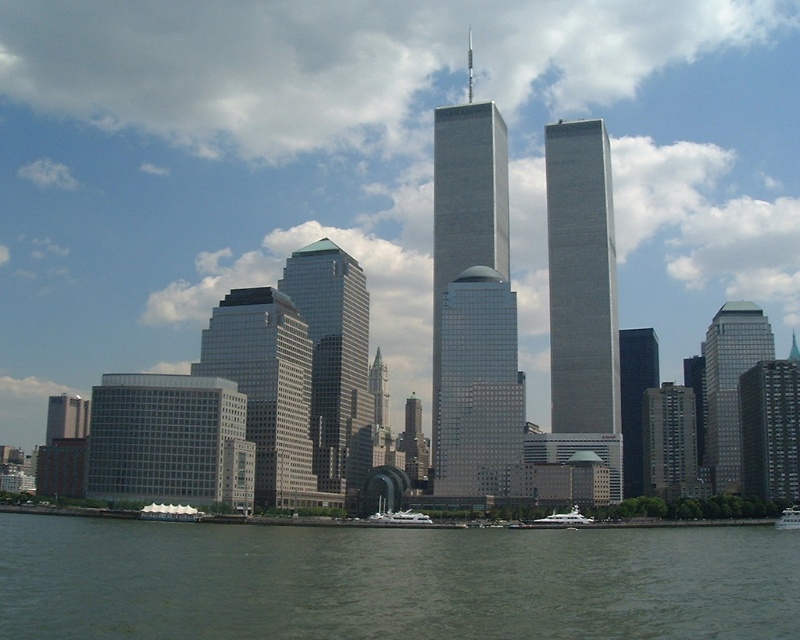
Is matte glass skyscraper at center-left behind gray glass building at center?

No.

From the picture: Who is positioned more to the left, matte glass skyscraper at center-left or gray glass building at center?

matte glass skyscraper at center-left is more to the left.

You are a GUI agent. You are given a task and a screenshot of the screen. Output one action in this format:
    pyautogui.click(x=<x>, y=<y>)
    Task: Click on the matte glass skyscraper at center-left
    The width and height of the screenshot is (800, 640).
    Given the screenshot: What is the action you would take?
    pyautogui.click(x=266, y=387)

How distant is gray glass building at center from green glass skyscraper at center?

gray glass building at center and green glass skyscraper at center are 46.06 meters apart from each other.

Is gray glass building at center smaller than green glass skyscraper at center?

Correct, gray glass building at center occupies less space than green glass skyscraper at center.

Find the location of a particular element. Image resolution: width=800 pixels, height=640 pixels. gray glass building at center is located at coordinates (670, 442).

The image size is (800, 640). I want to click on gray glass building at center, so click(670, 442).

Between matte glass skyscraper at center and white glossy boat at lower right, which one appears on the right side from the viewer's perspective?

white glossy boat at lower right is more to the right.

Can you confirm if matte glass skyscraper at center is wider than white glossy boat at lower right?

Indeed, matte glass skyscraper at center has a greater width compared to white glossy boat at lower right.

What do you see at coordinates (334, 358) in the screenshot? I see `matte glass skyscraper at center` at bounding box center [334, 358].

You are a GUI agent. You are given a task and a screenshot of the screen. Output one action in this format:
    pyautogui.click(x=<x>, y=<y>)
    Task: Click on the matte glass skyscraper at center
    The height and width of the screenshot is (640, 800).
    Given the screenshot: What is the action you would take?
    pyautogui.click(x=334, y=358)